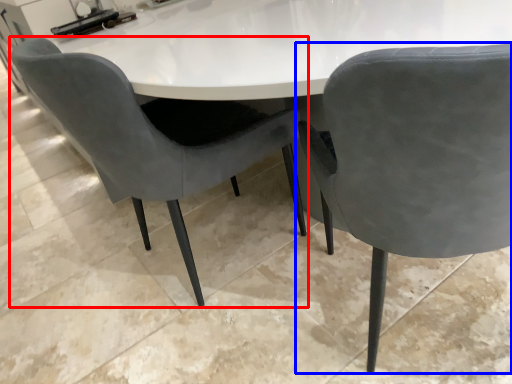
Question: Which point is closer to the camera, chair (highlighted by a red box) or chair (highlighted by a blue box)?

Choices:
 (A) chair
 (B) chair

Answer: (B)